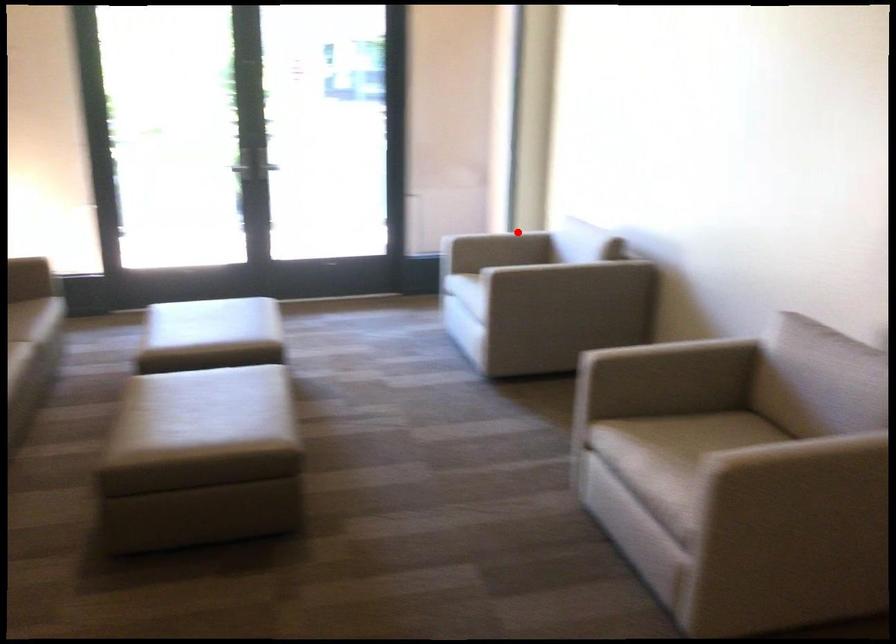
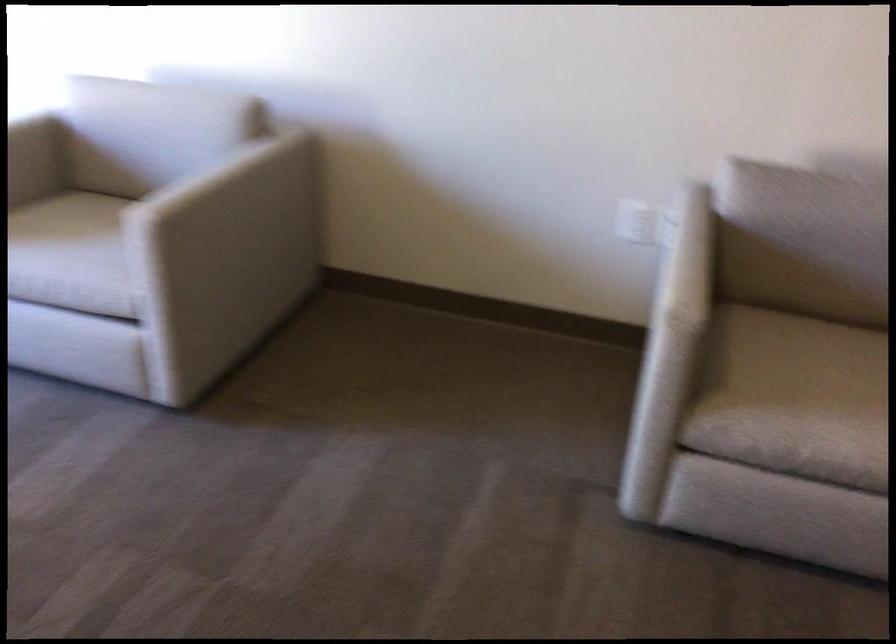
Locate, in the second image, the point that corresponds to the highlighted location in the first image.

(28, 124)